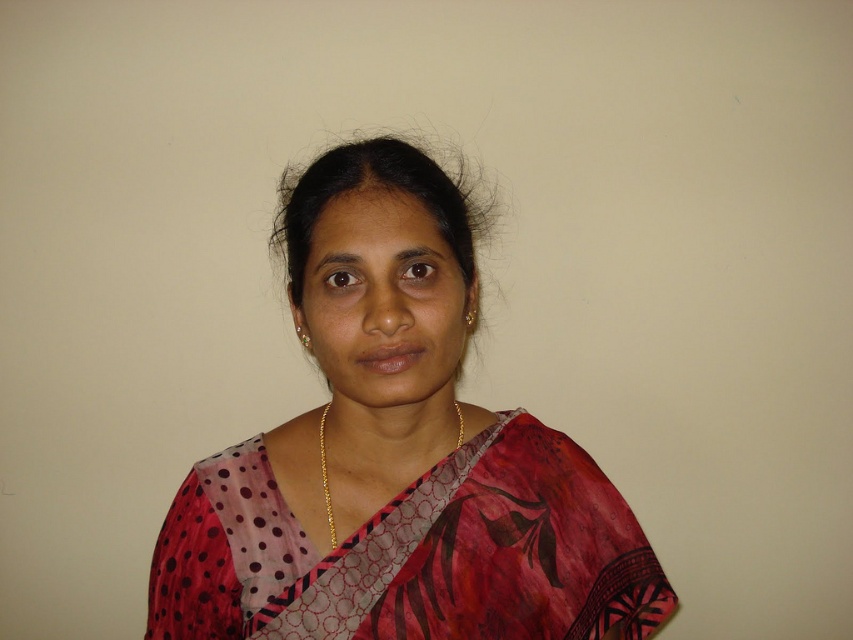
Question: Which point is closer to the camera taking this photo?

Choices:
 (A) (270, 625)
 (B) (380, 621)

Answer: (B)

Question: Can you confirm if polka dot fabric saree at center is wider than polka dot chiffon sari at center?

Choices:
 (A) no
 (B) yes

Answer: (B)

Question: Which is nearer to the gold chain necklace at center?

Choices:
 (A) polka dot chiffon sari at center
 (B) polka dot fabric saree at center

Answer: (A)

Question: Which is nearer to the polka dot fabric saree at center?

Choices:
 (A) polka dot chiffon sari at center
 (B) gold chain necklace at center

Answer: (A)

Question: Can you confirm if polka dot fabric saree at center is thinner than gold chain necklace at center?

Choices:
 (A) no
 (B) yes

Answer: (A)

Question: Does polka dot fabric saree at center appear over polka dot chiffon sari at center?

Choices:
 (A) no
 (B) yes

Answer: (B)